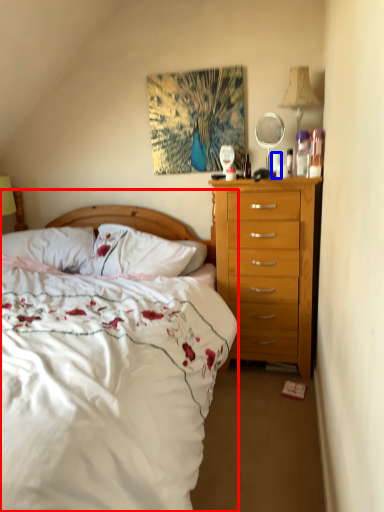
Question: Among these objects, which one is farthest to the camera, bed (highlighted by a red box) or coffee cup (highlighted by a blue box)?

Choices:
 (A) bed
 (B) coffee cup

Answer: (B)